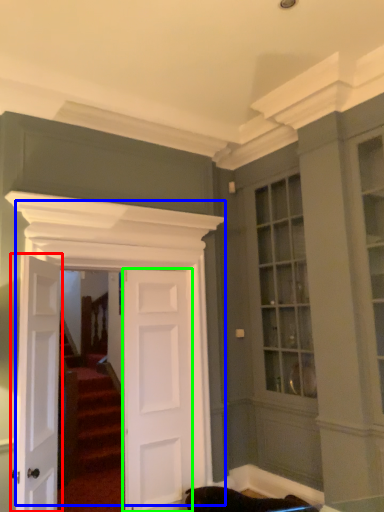
Question: Which object is the farthest from door (highlighted by a red box)? Choose among these: door (highlighted by a blue box) or door (highlighted by a green box).

Choices:
 (A) door
 (B) door

Answer: (B)